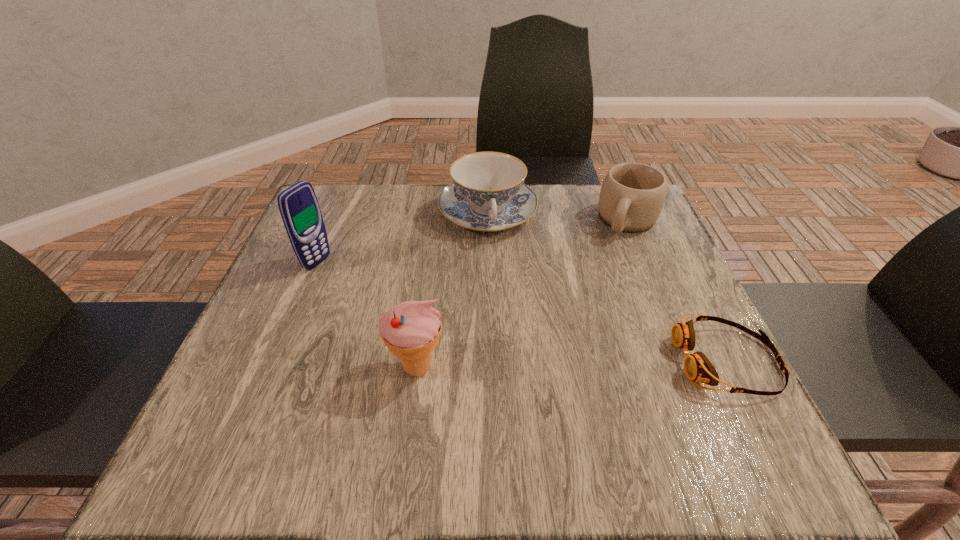
Locate an element on the screen. The image size is (960, 540). free region located on the front-facing side of the leftmost object is located at coordinates (346, 278).

Where is `vacant space located on the front-facing side of the leftmost object`? vacant space located on the front-facing side of the leftmost object is located at coordinates (385, 295).

This screenshot has height=540, width=960. I want to click on free space located 0.340m on the front-facing side of the leftmost object, so click(454, 325).

The image size is (960, 540). What are the coordinates of `vacant space situated 0.140m on the side of the mug with the handle` in the screenshot? It's located at (602, 274).

Locate an element on the screen. free spot located on the side of the mug with the handle is located at coordinates (576, 321).

You are a GUI agent. You are given a task and a screenshot of the screen. Output one action in this format:
    pyautogui.click(x=<x>, y=<y>)
    Task: Click on the vacant region located on the side of the mug with the handle
    
    Given the screenshot: What is the action you would take?
    pyautogui.click(x=614, y=251)

The height and width of the screenshot is (540, 960). I want to click on vacant space located 0.230m with the handle on the side of the chinaware, so click(517, 315).

In order to click on vacant space located with the handle on the side of the chinaware in this screenshot , I will do 531,363.

I want to click on free spot located with the handle on the side of the chinaware, so click(x=509, y=288).

The height and width of the screenshot is (540, 960). What are the coordinates of `mug present at the far edge` in the screenshot? It's located at (632, 195).